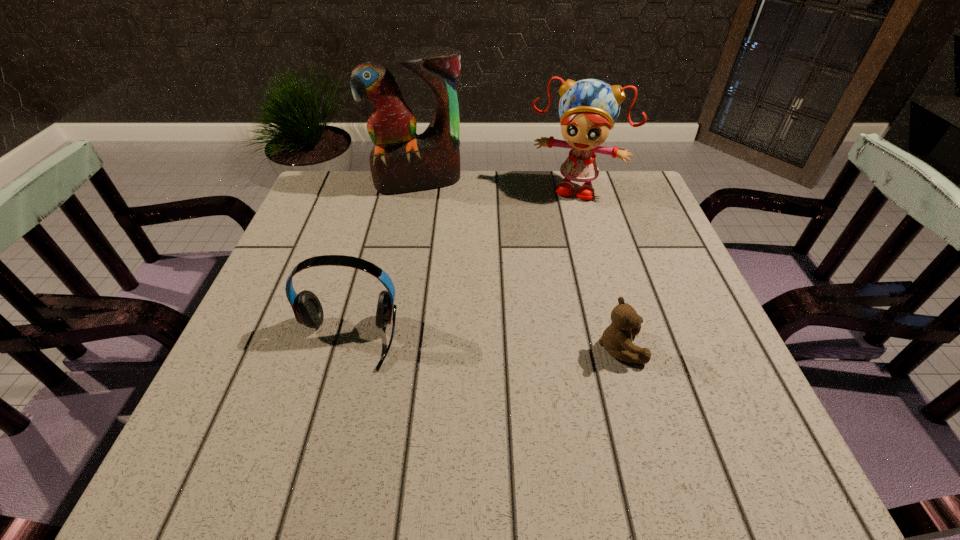
Identify the location of headset. pos(308,311).

Locate an element on the screen. The height and width of the screenshot is (540, 960). teddy bear is located at coordinates (617, 338).

Where is `parrot`? The width and height of the screenshot is (960, 540). parrot is located at coordinates (401, 161).

You are a GUI agent. You are given a task and a screenshot of the screen. Output one action in this format:
    pyautogui.click(x=<x>, y=<y>)
    Task: Click on the doll
    This screenshot has height=540, width=960.
    Given the screenshot: What is the action you would take?
    pyautogui.click(x=588, y=109)

This screenshot has height=540, width=960. Find the location of `vacant space located 0.060m with the microphone attached to the side of the third tallest object`. vacant space located 0.060m with the microphone attached to the side of the third tallest object is located at coordinates [x=330, y=402].

At what (x,y) coordinates should I click in order to perform the action: click on free region located on the front-facing side of the shortest object. Please return your answer as a coordinate pair (x, y). Image resolution: width=960 pixels, height=540 pixels. Looking at the image, I should click on (669, 348).

I want to click on free location located at the face of the tallest object, so click(432, 232).

The image size is (960, 540). Identify the location of free space located 0.250m at the face of the tallest object. (437, 255).

Where is `vacant space positioned 0.400m at the face of the tallest object`? This screenshot has height=540, width=960. vacant space positioned 0.400m at the face of the tallest object is located at coordinates (446, 301).

What are the coordinates of `vacant area situated 0.070m on the face of the second tallest object` in the screenshot? It's located at (559, 217).